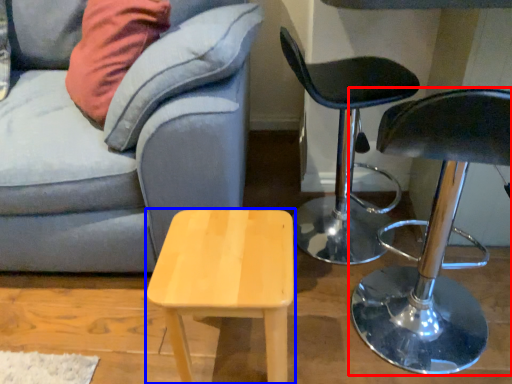
Question: Which object is further to the camera taking this photo, chair (highlighted by a red box) or stool (highlighted by a blue box)?

Choices:
 (A) chair
 (B) stool

Answer: (B)